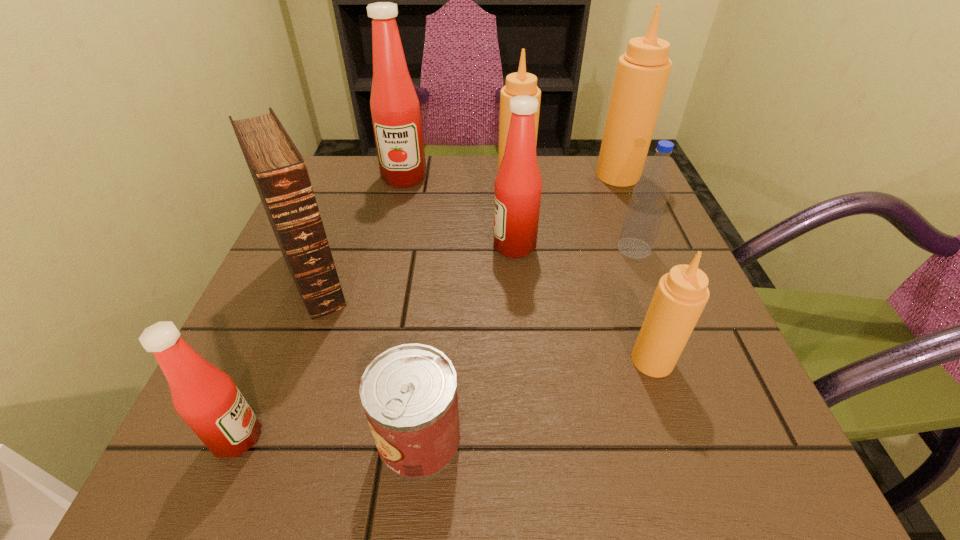
Identify the location of vacant space located on the left of the water bottle. The width and height of the screenshot is (960, 540). (444, 249).

In order to click on vacant space located 0.100m on the back of the second nearest condiment in this screenshot , I will do `click(632, 299)`.

Locate an element on the screen. vacant space positioned on the front-facing side of the leftmost condiment is located at coordinates (407, 437).

Where is `free space located 0.120m on the back of the can`? free space located 0.120m on the back of the can is located at coordinates (430, 337).

Image resolution: width=960 pixels, height=540 pixels. In order to click on condiment that is positioned at the near edge in this screenshot , I will do `click(206, 398)`.

The height and width of the screenshot is (540, 960). I want to click on can that is at the near edge, so click(409, 392).

Locate an element on the screen. Image resolution: width=960 pixels, height=540 pixels. Bible that is at the left edge is located at coordinates (279, 172).

Where is `water bottle at the right edge`? Image resolution: width=960 pixels, height=540 pixels. water bottle at the right edge is located at coordinates 644,214.

You are a GUI agent. You are given a task and a screenshot of the screen. Output one action in this format:
    pyautogui.click(x=<x>, y=<y>)
    Task: Click on the object that is at the far left corner
    This screenshot has width=960, height=540.
    Given the screenshot: What is the action you would take?
    pyautogui.click(x=395, y=109)

This screenshot has width=960, height=540. I want to click on object situated at the near left corner, so click(x=206, y=398).